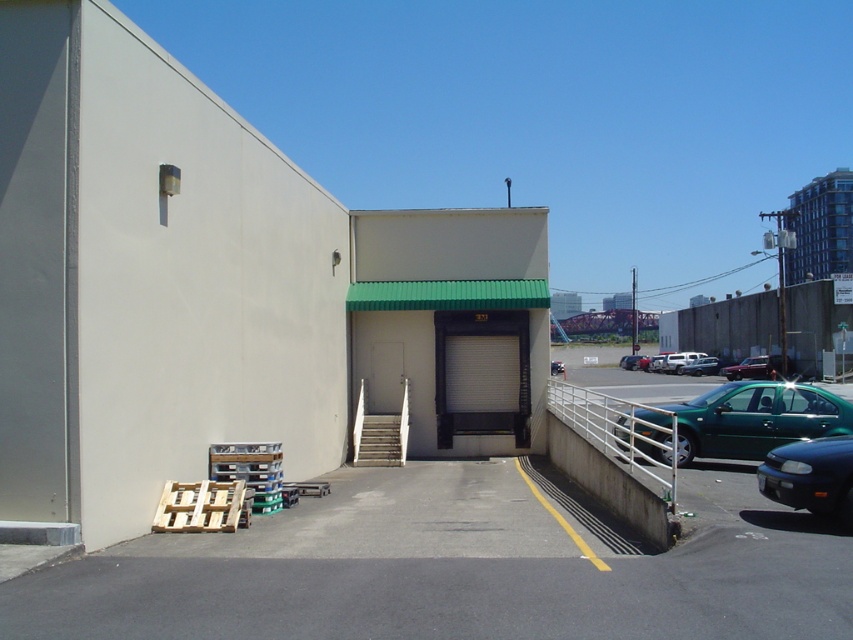
You are standing at the entrance of the building and want to park your car at the exact position where the green matte sedan at lower right is parked. What are the coordinates of the parking spot?

The coordinates of the parking spot where the green matte sedan at lower right is parked are at point (811, 476).